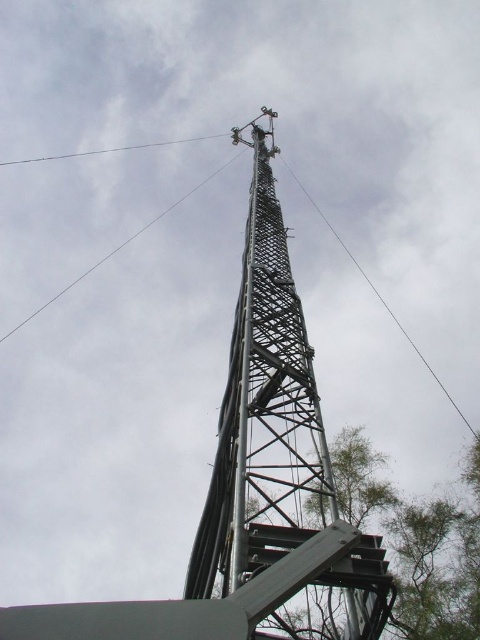
Question: Can you confirm if metallic lattice tower at center is positioned to the right of green leafy tree at bottom right?

Choices:
 (A) yes
 (B) no

Answer: (B)

Question: Which object is closer to the camera taking this photo?

Choices:
 (A) green leafy tree at bottom right
 (B) metallic lattice tower at center

Answer: (B)

Question: Which point appears closest to the camera in this image?

Choices:
 (A) (399, 577)
 (B) (7, 332)
 (C) (430, 371)
 (D) (0, 164)

Answer: (A)

Question: Among these points, which one is farthest from the camera?

Choices:
 (A) (131, 145)
 (B) (456, 544)
 (C) (143, 228)

Answer: (A)

Question: Does metallic lattice tower at center have a greater width compared to smooth wire at upper center?

Choices:
 (A) yes
 (B) no

Answer: (B)

Question: Can you confirm if metallic grid tower at upper center is bigger than smooth wire at upper center?

Choices:
 (A) yes
 (B) no

Answer: (A)